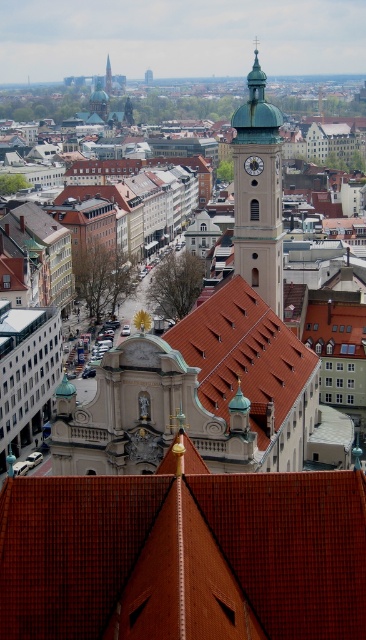
Question: Can you confirm if brown tiled roof at center is thinner than green glass spire at upper center?

Choices:
 (A) no
 (B) yes

Answer: (A)

Question: Does brown tile roof at center have a greater width compared to light brown stone bell tower at center?

Choices:
 (A) no
 (B) yes

Answer: (B)

Question: Which object is the closest to the brown tiled roof at center?

Choices:
 (A) green glass spire at upper center
 (B) light brown stone bell tower at center

Answer: (B)

Question: Is brown tiled roof at center above green glass spire at upper center?

Choices:
 (A) yes
 (B) no

Answer: (B)

Question: Which of the following is the closest to the observer?

Choices:
 (A) light brown stone bell tower at center
 (B) green glass spire at upper center
 (C) brown tile roof at center

Answer: (C)

Question: Which object is closer to the camera taking this photo?

Choices:
 (A) light brown stone bell tower at center
 (B) green glass spire at upper center

Answer: (A)